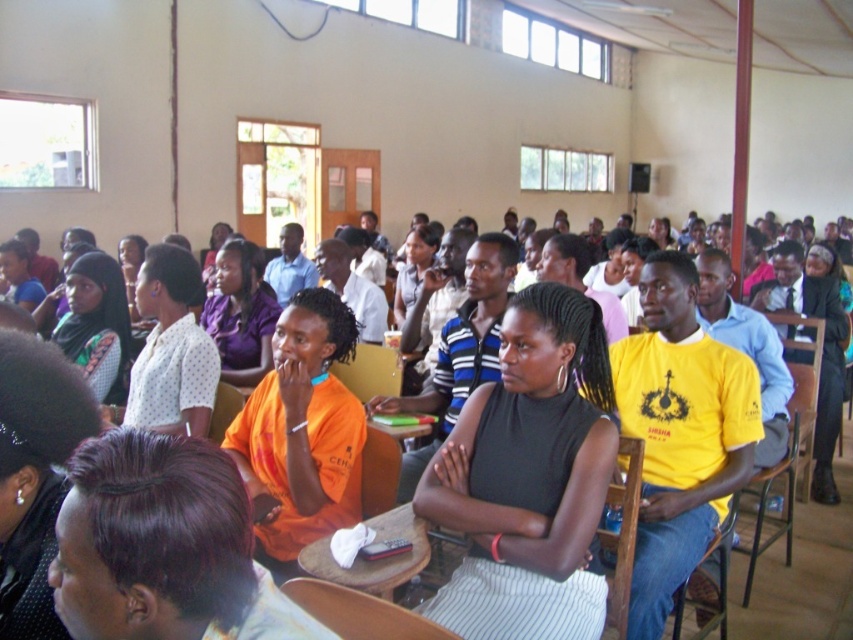
Which is more to the left, dark purple hair at center or matte black hijab at center?

Positioned to the left is matte black hijab at center.

Is point (71, 605) closer to camera compared to point (67, 301)?

Yes, point (71, 605) is in front of point (67, 301).

Which is behind, point (85, 518) or point (97, 266)?

The point (97, 266) is behind.

Identify the location of dark purple hair at center. The image size is (853, 640). (163, 547).

Does matte black hijab at center lie behind purple matte shirt at center?

No, it is not.

Can you confirm if matte black hijab at center is bigger than purple matte shirt at center?

Actually, matte black hijab at center might be smaller than purple matte shirt at center.

Which is in front, point (97, 312) or point (234, 317)?

Point (97, 312) is in front.

At what (x,y) coordinates should I click in order to perform the action: click on matte black hijab at center. Please return your answer as a coordinate pair (x, y). The image size is (853, 640). Looking at the image, I should click on (97, 324).

Find the location of a particular element. This screenshot has height=640, width=853. black fabric headscarf at upper left is located at coordinates (33, 474).

Can you confirm if black fabric headscarf at upper left is positioned to the right of orange fabric chair at center?

Yes, black fabric headscarf at upper left is to the right of orange fabric chair at center.

Describe the element at coordinates (33, 474) in the screenshot. I see `black fabric headscarf at upper left` at that location.

Identify the location of black fabric headscarf at upper left. The image size is (853, 640). (33, 474).